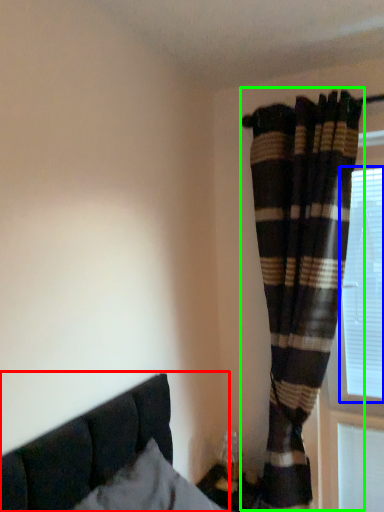
Question: Which object is positioned closest to bed (highlighted by a red box)? Select from bay window (highlighted by a blue box) and curtain (highlighted by a green box).

Choices:
 (A) bay window
 (B) curtain

Answer: (B)